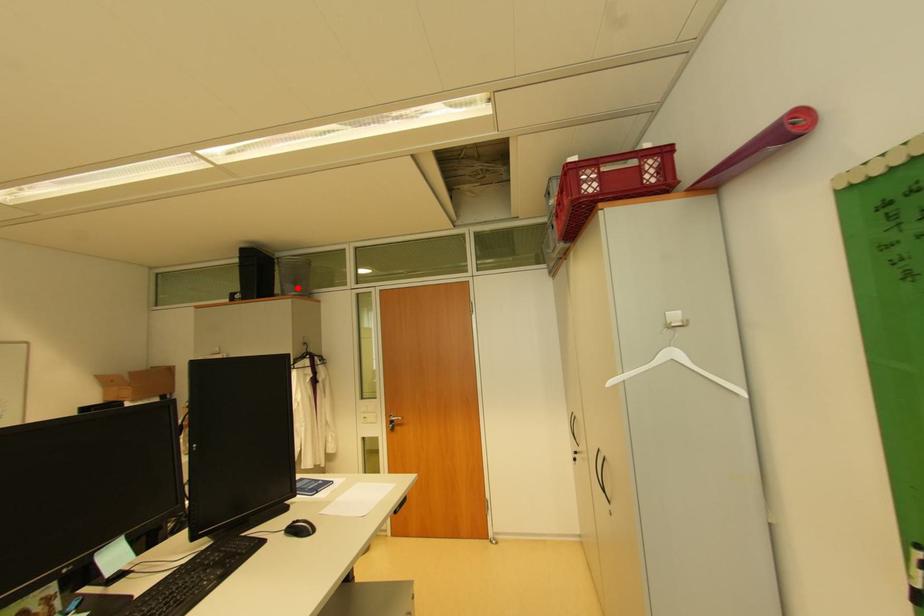
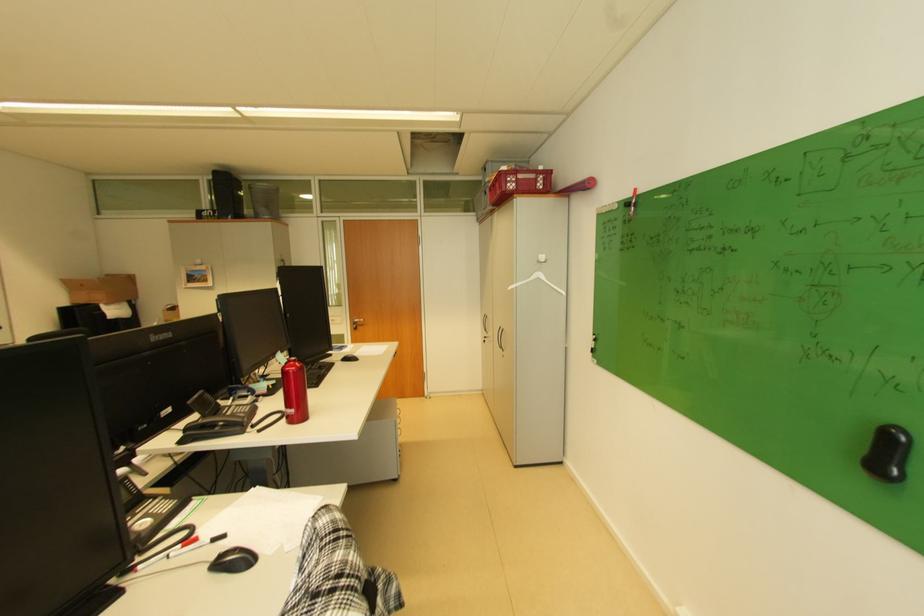
Question: I am providing you with two images of the same scene from different viewpoints. Given a red point in image1, look at the same physical point in image2. Is it:

Choices:
 (A) Closer to the viewpoint
 (B) Farther from the viewpoint

Answer: (A)